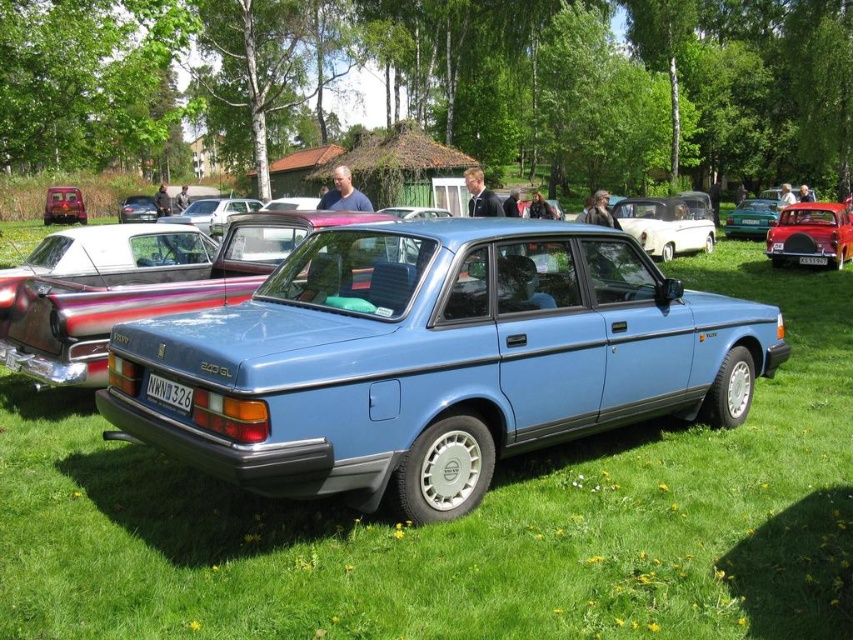
You are standing at the car show and want to take a photo of the two points marked in the image. Which point, point [44,214] or point [804,262], is closer to your camera when taking the photo?

Point [44,214] is closer to the camera than point [804,262] because it is further to the camera than the other point.

You are standing at the event and want to take a closer look at the metallic teal sedan at center. Based on its distance from you, would it be easy to see the details of the sedan from where you are standing?

The metallic teal sedan at center is 25.02 meters away from the camera, so it might be difficult to see the details clearly from that distance unless you move closer.